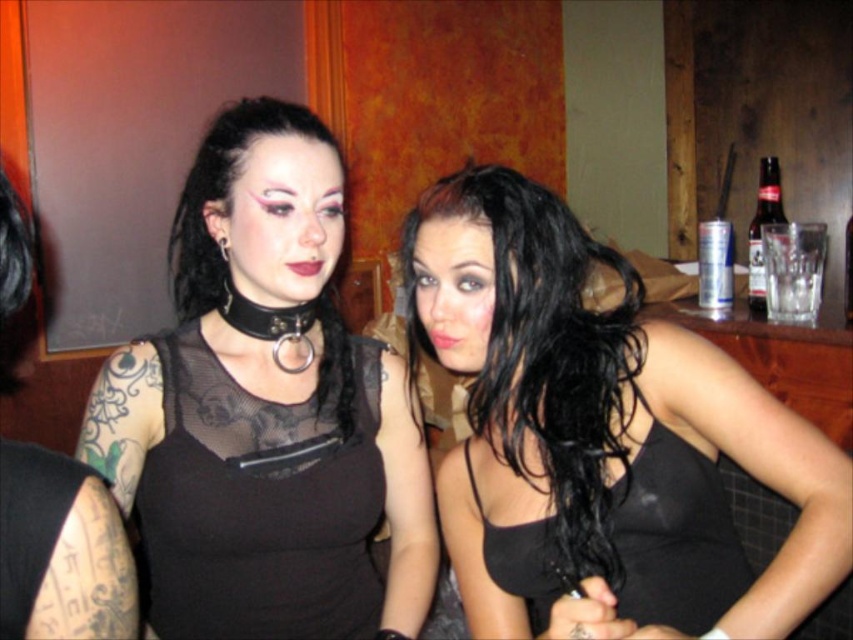
You are a photographer adjusting your camera settings to focus on the two people in the image. Since both the matte black top at center and the matte black choker at center are in the frame, which one should you focus on first to ensure the closest object is sharp?

The matte black top at center is closer to the viewer than the matte black choker at center, so you should focus on the matte black top at center first to ensure the closest object is sharp.

You are a fashion designer observing two people in a dimly lit bar. You notice the black matte tank top at center and the matte black top at center. Which one is positioned lower on the body?

The black matte tank top at center is located below the matte black top at center, so it is positioned lower on the body.

You are a fashion designer analyzing the image of two people wearing black tops. The tops are labeled as the black matte tank top at center and the matte black top at center. Which of these two tops appears shorter in the image?

The black matte tank top at center has a lesser height compared to the matte black top at center, so the black matte tank top at center appears shorter.